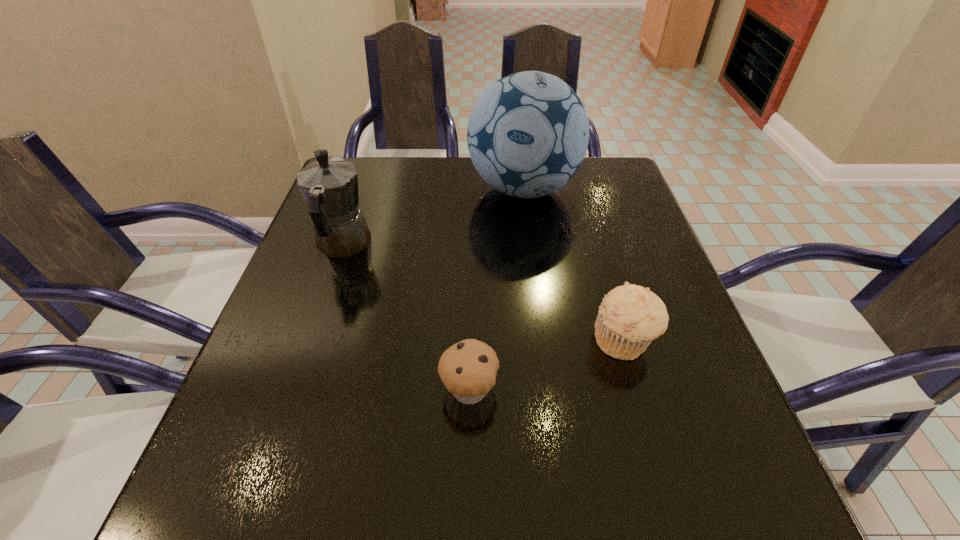
Identify the location of vacant region at the left edge. (281, 301).

Locate an element on the screen. Image resolution: width=960 pixels, height=540 pixels. vacant area at the right edge of the desktop is located at coordinates (588, 244).

Where is `free space at the far left corner of the desktop`? Image resolution: width=960 pixels, height=540 pixels. free space at the far left corner of the desktop is located at coordinates (361, 187).

Find the location of a particular element. The image size is (960, 540). vacant space at the far right corner is located at coordinates (627, 176).

I want to click on free area in between the soccer ball and the left muffin, so click(496, 289).

The width and height of the screenshot is (960, 540). In order to click on empty space that is in between the shorter muffin and the coffeepot in this screenshot , I will do [406, 317].

Find the location of a particular element. Image resolution: width=960 pixels, height=540 pixels. vacant space that's between the second tallest object and the tallest object is located at coordinates (433, 217).

Identify the location of empty space between the leftmost object and the taller muffin. This screenshot has height=540, width=960. (484, 293).

Identify the location of free space between the taller muffin and the soccer ball. The image size is (960, 540). (574, 265).

Where is `empty space that is in between the third shortest object and the third tallest object`? The width and height of the screenshot is (960, 540). empty space that is in between the third shortest object and the third tallest object is located at coordinates (484, 293).